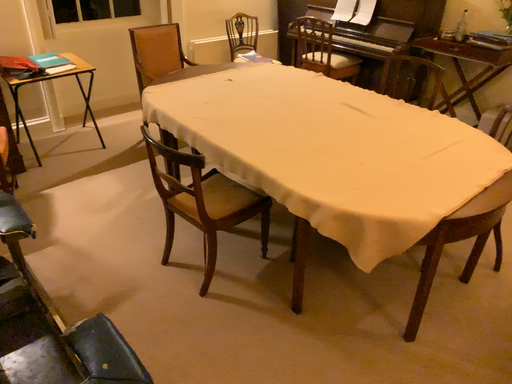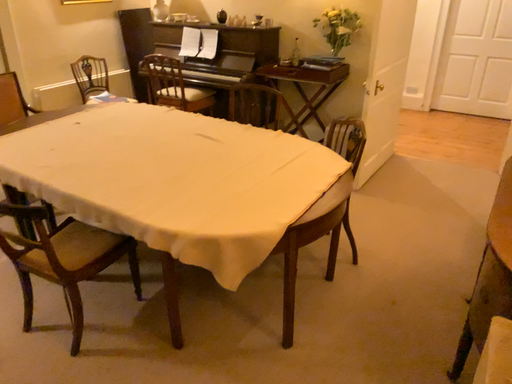
Question: How did the camera likely rotate when shooting the video?

Choices:
 (A) rotated right
 (B) rotated left

Answer: (A)